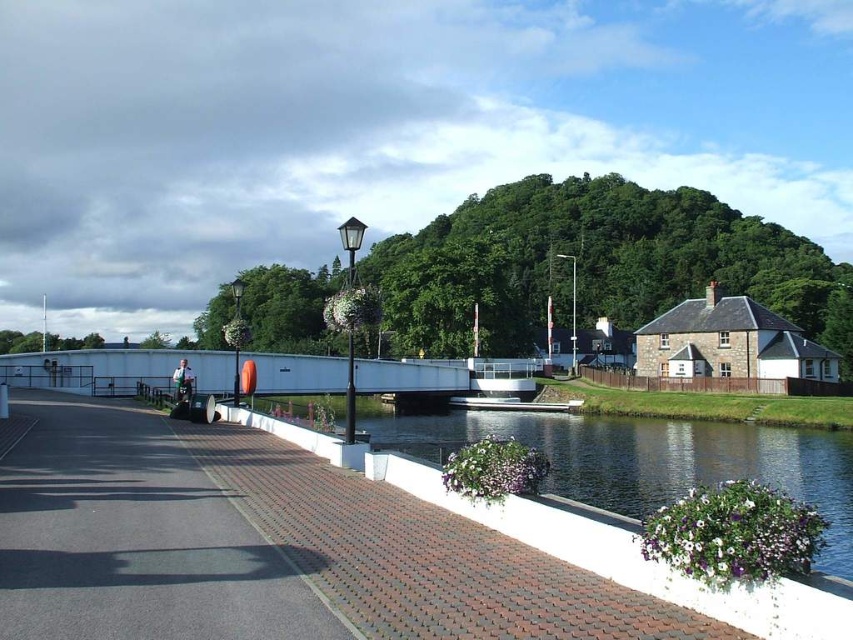
You are standing at the center of the image and want to walk towards the white concrete wall at lower center. In which direction should you move?

Since the white concrete wall at lower center is located at point (646, 458) in 2D coordinates, you should move downward and to the right to reach it from the center of the image.

You are standing at the viewpoint where the image was taken. There are two points marked in the scene. Which point, point (210, 616) or point (648, 428), is closer to you?

Point (210, 616) is closer to the camera than point (648, 428), so it is closer to you.

You are standing at the point marked by the coordinates point (134, 538) and want to cross the river to the other side. The white pedestrian bridge is your only option. Is the bridge accessible from your current position? Please explain.

The point (134, 538) is located at the dark gray asphalt at lower left, which is not near the white pedestrian bridge. Therefore, the bridge is not accessible from your current position.